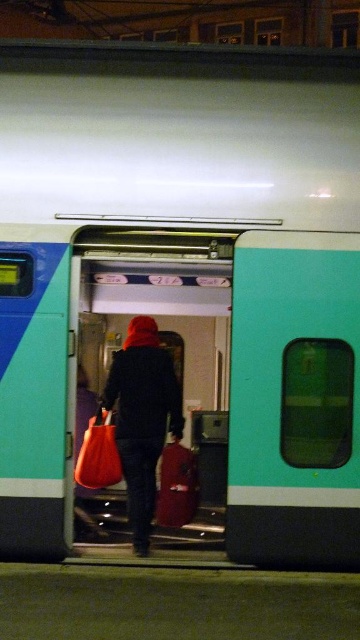
You are a security guard at the train station. You notice a person entering the train wearing a dark blue fabric coat at center and carrying a matte orange bag at center. Based on their spatial arrangement, which item is closer to the ceiling of the train?

The dark blue fabric coat at center is located above the matte orange bag at center, so the dark blue fabric coat at center is closer to the ceiling of the train.